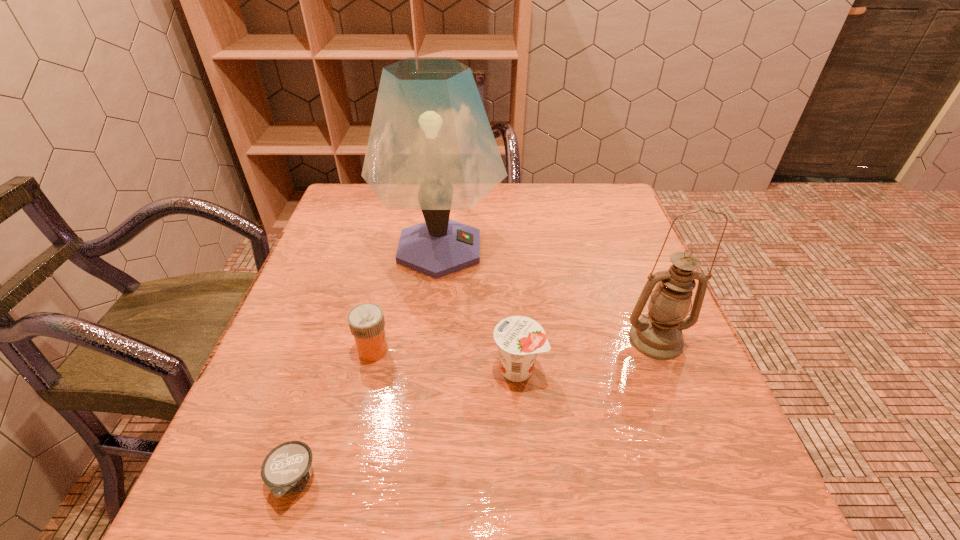
Locate an element on the screen. The width and height of the screenshot is (960, 540). empty space that is in between the fourth shortest object and the taller yogurt is located at coordinates (587, 354).

Identify the location of empty space that is in between the farthest object and the rightmost object. (548, 294).

Identify the location of free space between the tallest object and the nearer yogurt. The image size is (960, 540). (367, 364).

Identify the location of empty space between the right yogurt and the oil lamp. (587, 354).

This screenshot has width=960, height=540. In order to click on vacant space in between the taller yogurt and the rightmost object in this screenshot , I will do `click(587, 354)`.

This screenshot has height=540, width=960. I want to click on vacant space that's between the rightmost object and the right yogurt, so (587, 354).

Identify which object is the fourth closest to the right yogurt. Please provide its 2D coordinates. Your answer should be formatted as a tuple, i.e. [(x, y)], where the tuple contains the x and y coordinates of a point satisfying the conditions above.

[(287, 468)]

Identify the location of the third closest object relative to the medicine. Image resolution: width=960 pixels, height=540 pixels. click(519, 339).

Identify the location of free location that satisfies the following two spatial constraints: 1. on the base of the farthest object; 2. on the right side of the farther yogurt. (426, 369).

Image resolution: width=960 pixels, height=540 pixels. In order to click on blank area in the image that satisfies the following two spatial constraints: 1. on the back side of the shorter yogurt; 2. on the right side of the farther yogurt in this screenshot , I will do `click(328, 369)`.